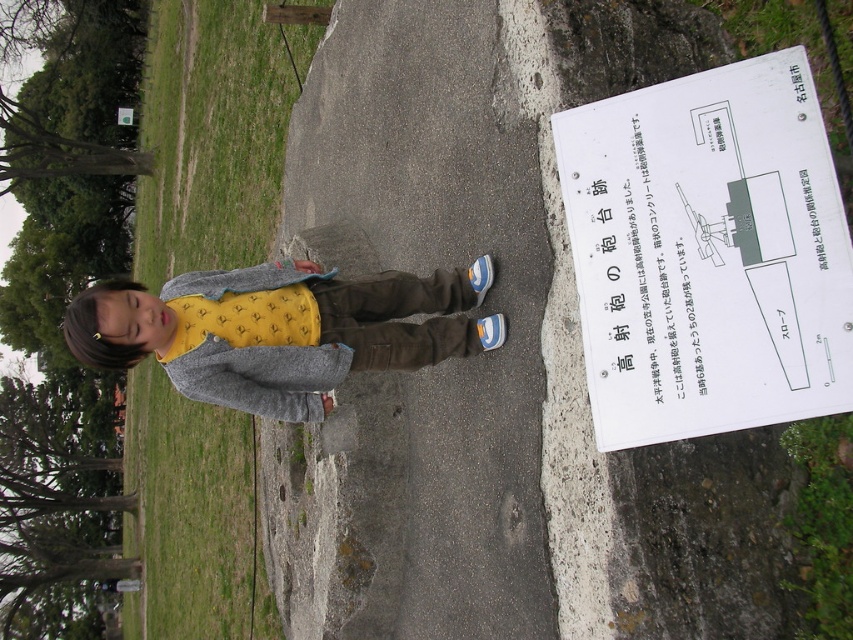
You are a GUI agent. You are given a task and a screenshot of the screen. Output one action in this format:
    pyautogui.click(x=<x>, y=<y>)
    Task: Click on the green grass at lower left
    The height and width of the screenshot is (640, 853).
    Given the screenshot: What is the action you would take?
    pyautogui.click(x=210, y=138)

Does green grass at lower left appear under yellow cotton shirt at center?

Correct, green grass at lower left is located below yellow cotton shirt at center.

Who is more forward, (154, 637) or (463, 330)?

Point (463, 330) is more forward.

This screenshot has width=853, height=640. Identify the location of green grass at lower left. (210, 138).

Which is below, white paper sign at right or green grass at lower left?

green grass at lower left

Based on the photo, measure the distance from white paper sign at right to green grass at lower left.

They are 14.46 meters apart.

Is point (601, 413) in front of point (161, 128)?

Yes, point (601, 413) is in front of point (161, 128).

Locate an element on the screen. This screenshot has width=853, height=640. white paper sign at right is located at coordinates (708, 253).

Which of these two, gray concrete pavement at center or green grass at lower left, stands taller?

With more height is green grass at lower left.

Is gray concrete pavement at center bigger than green grass at lower left?

No, gray concrete pavement at center is not bigger than green grass at lower left.

Between point (369, 202) and point (242, 467), which one is positioned in front?

Positioned in front is point (369, 202).

Find the location of a particular element. The height and width of the screenshot is (640, 853). gray concrete pavement at center is located at coordinates (433, 368).